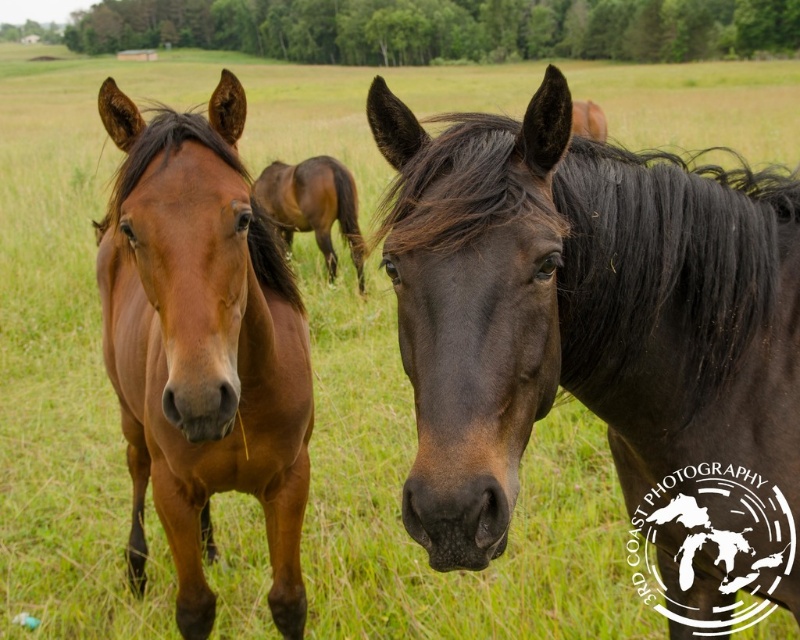
You are standing in the field and want to approach the shiny dark brown horse at center. If your height is 66 inches, can you safely reach the horse without needing to bend down too much?

The shiny dark brown horse at center and viewer are 39.01 inches apart from each other. Since the distance between you and the horse is less than your height of 66 inches, you can safely approach the horse without needing to bend down too much.

Consider the image. You are a photographer trying to capture the shiny dark brown horse at center and the brown glossy horse at center in your shot. Which horse is closer to the camera?

The shiny dark brown horse at center is closer to the camera than the brown glossy horse at center because it is positioned in front of it.

You are a photographer standing in the field and want to take a photo of the shiny brown horse at center and the brown glossy horse at center. Which horse is positioned to the right when you look at them from your current viewpoint?

The shiny brown horse at center is positioned to the right of the brown glossy horse at center.